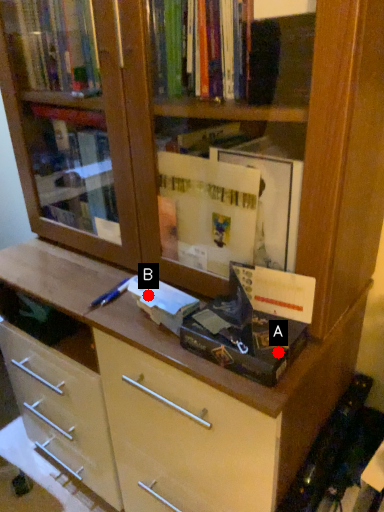
Question: Two points are circled on the image, labeled by A and B beside each circle. Which point is closer to the camera?

Choices:
 (A) A is closer
 (B) B is closer

Answer: (A)